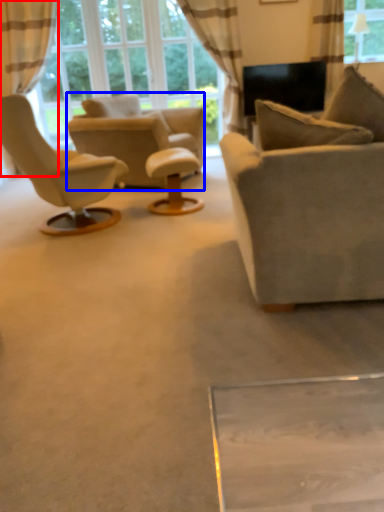
Question: Which object is closer to the camera taking this photo, curtain (highlighted by a red box) or chair (highlighted by a blue box)?

Choices:
 (A) curtain
 (B) chair

Answer: (B)